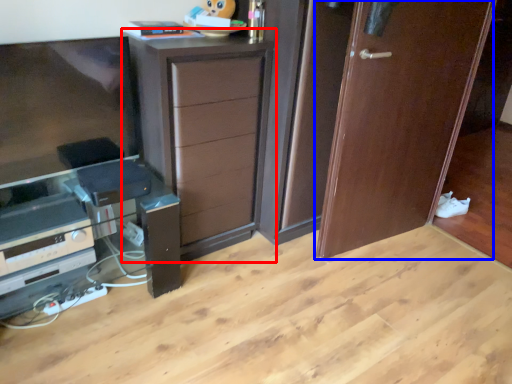
Question: Which of the following is the farthest to the observer, chest of drawers (highlighted by a red box) or door (highlighted by a blue box)?

Choices:
 (A) chest of drawers
 (B) door

Answer: (B)